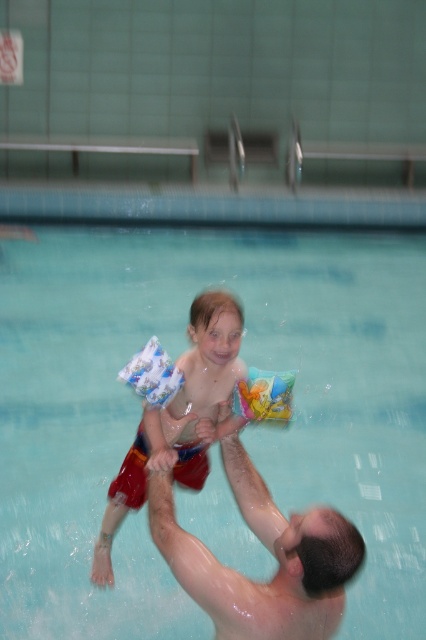
You are standing at the edge of the pool and want to reach both points in the water. Which point, point (x=219, y=332) or point (x=132, y=364), is closer to you?

Point (x=219, y=332) is closer to the viewer than point (x=132, y=364).

You are a lifeguard observing the scene and need to ensure the safety of the child. Which object is positioned to the right of the other between the white printed armbands at center and the white printed floaties at center?

The white printed armbands at center is to the right of the white printed floaties at center.